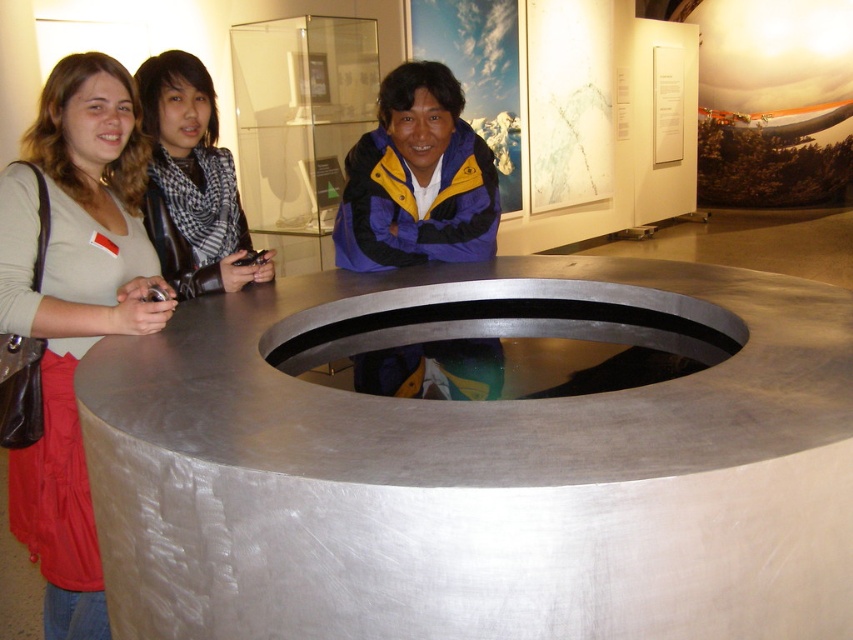
Question: Can you confirm if matte beige shirt at left is smaller than matte blue jacket at center?

Choices:
 (A) yes
 (B) no

Answer: (B)

Question: Which point is closer to the camera taking this photo?

Choices:
 (A) (42, 356)
 (B) (488, 182)
 (C) (207, 237)

Answer: (A)

Question: Estimate the real-world distances between objects in this image. Which object is closer to the black leather jacket at center?

Choices:
 (A) matte beige shirt at left
 (B) matte blue jacket at center

Answer: (A)

Question: Where is matte beige shirt at left located in relation to matte blue jacket at center in the image?

Choices:
 (A) right
 (B) left

Answer: (B)

Question: Which of these objects is positioned closest to the black leather jacket at center?

Choices:
 (A) matte beige shirt at left
 (B) matte blue jacket at center

Answer: (A)

Question: Does matte beige shirt at left have a greater width compared to matte blue jacket at center?

Choices:
 (A) no
 (B) yes

Answer: (A)